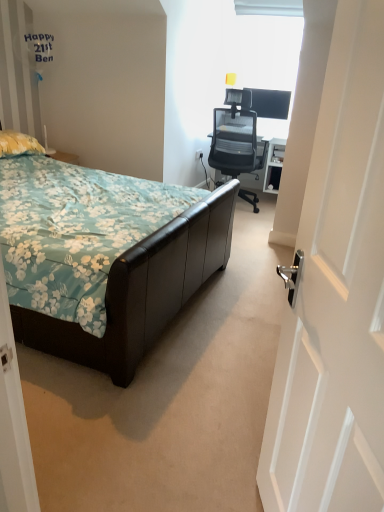
Question: Can you confirm if yellow fabric pillow at left is taller than leather bed at left?

Choices:
 (A) yes
 (B) no

Answer: (B)

Question: Is yellow fabric pillow at left far from leather bed at left?

Choices:
 (A) no
 (B) yes

Answer: (B)

Question: From the image's perspective, is yellow fabric pillow at left above leather bed at left?

Choices:
 (A) no
 (B) yes

Answer: (B)

Question: Considering the relative sizes of yellow fabric pillow at left and leather bed at left in the image provided, is yellow fabric pillow at left smaller than leather bed at left?

Choices:
 (A) no
 (B) yes

Answer: (B)

Question: Is yellow fabric pillow at left oriented towards leather bed at left?

Choices:
 (A) yes
 (B) no

Answer: (A)

Question: From the image's perspective, relative to transparent glass window at upper center, is matte black monitor at upper right above or below?

Choices:
 (A) below
 (B) above

Answer: (A)

Question: In the image, is matte black monitor at upper right positioned in front of or behind transparent glass window at upper center?

Choices:
 (A) behind
 (B) front

Answer: (A)

Question: Would you say matte black monitor at upper right is to the left or to the right of transparent glass window at upper center in the picture?

Choices:
 (A) left
 (B) right

Answer: (A)

Question: Is matte black monitor at upper right wider or thinner than transparent glass window at upper center?

Choices:
 (A) thin
 (B) wide

Answer: (A)

Question: Considering the relative positions of white glossy door at right and yellow fabric pillow at left in the image provided, is white glossy door at right to the left or to the right of yellow fabric pillow at left?

Choices:
 (A) right
 (B) left

Answer: (A)

Question: Is white glossy door at right situated inside yellow fabric pillow at left or outside?

Choices:
 (A) outside
 (B) inside

Answer: (A)

Question: From a real-world perspective, is white glossy door at right physically located above or below yellow fabric pillow at left?

Choices:
 (A) below
 (B) above

Answer: (B)

Question: From the image's perspective, relative to yellow fabric pillow at left, is white glossy door at right above or below?

Choices:
 (A) above
 (B) below

Answer: (B)

Question: From their relative heights in the image, would you say yellow fabric pillow at left is taller or shorter than black mesh office chair at upper right?

Choices:
 (A) short
 (B) tall

Answer: (A)

Question: Considering the positions of yellow fabric pillow at left and black mesh office chair at upper right in the image, is yellow fabric pillow at left wider or thinner than black mesh office chair at upper right?

Choices:
 (A) wide
 (B) thin

Answer: (B)